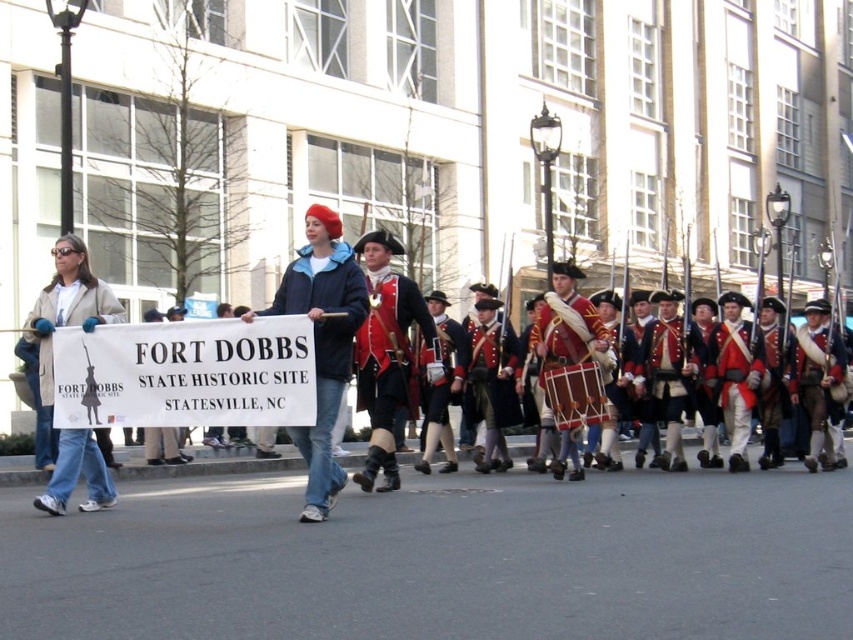
Between point (358, 275) and point (589, 392), which one is positioned behind?

Positioned behind is point (589, 392).

Is denim jacket at center to the left of wooden drum at center from the viewer's perspective?

Yes, denim jacket at center is to the left of wooden drum at center.

Is point (317, 250) farther from camera compared to point (550, 371)?

No, it is in front of (550, 371).

At what (x,y) coordinates should I click in order to perform the action: click on denim jacket at center. Please return your answer as a coordinate pair (x, y). Image resolution: width=853 pixels, height=640 pixels. Looking at the image, I should click on (322, 340).

Does point (322, 228) lie behind point (83, 305)?

No, it is not.

Who is more forward, (341,250) or (51,248)?

Point (341,250)

This screenshot has width=853, height=640. Describe the element at coordinates (322, 340) in the screenshot. I see `denim jacket at center` at that location.

Where is `denim jacket at center`? This screenshot has width=853, height=640. denim jacket at center is located at coordinates (322, 340).

Is shiny red coat at center below denim jacket at left?

Yes, shiny red coat at center is below denim jacket at left.

Who is more distant from viewer, [384,388] or [39,340]?

The point [384,388] is more distant.

Is point (387, 451) farther from camera compared to point (50, 401)?

Yes, point (387, 451) is behind point (50, 401).

The height and width of the screenshot is (640, 853). In order to click on shiny red coat at center in this screenshot , I will do `click(386, 355)`.